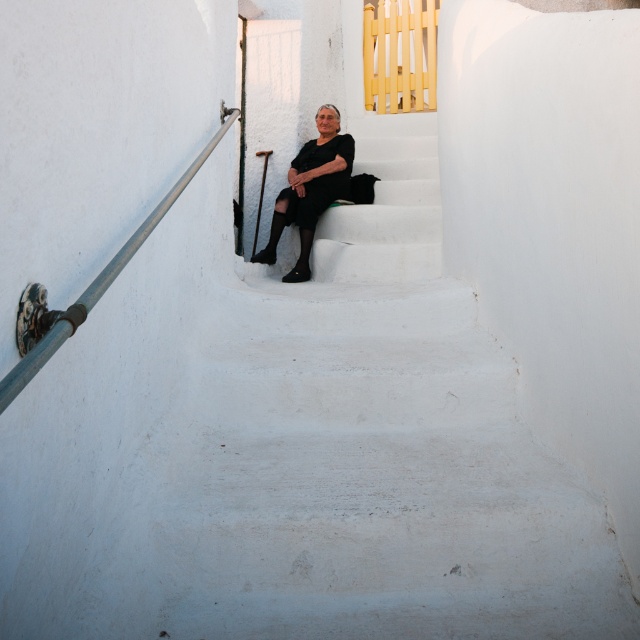
Question: Can you confirm if white matte stairs at center is wider than metallic gray handrail at left?

Choices:
 (A) no
 (B) yes

Answer: (B)

Question: Which point is closer to the camera?

Choices:
 (A) (128, 246)
 (B) (332, 221)

Answer: (A)

Question: Among these points, which one is farthest from the camera?

Choices:
 (A) (356, 214)
 (B) (93, 292)
 (C) (332, 176)

Answer: (C)

Question: Does white matte stairs at center appear under metallic gray handrail at left?

Choices:
 (A) yes
 (B) no

Answer: (A)

Question: Which object appears closest to the camera in this image?

Choices:
 (A) white matte stairs at center
 (B) black matte dress at center
 (C) metallic gray handrail at left

Answer: (C)

Question: Does white matte stairs at center have a smaller size compared to metallic gray handrail at left?

Choices:
 (A) yes
 (B) no

Answer: (B)